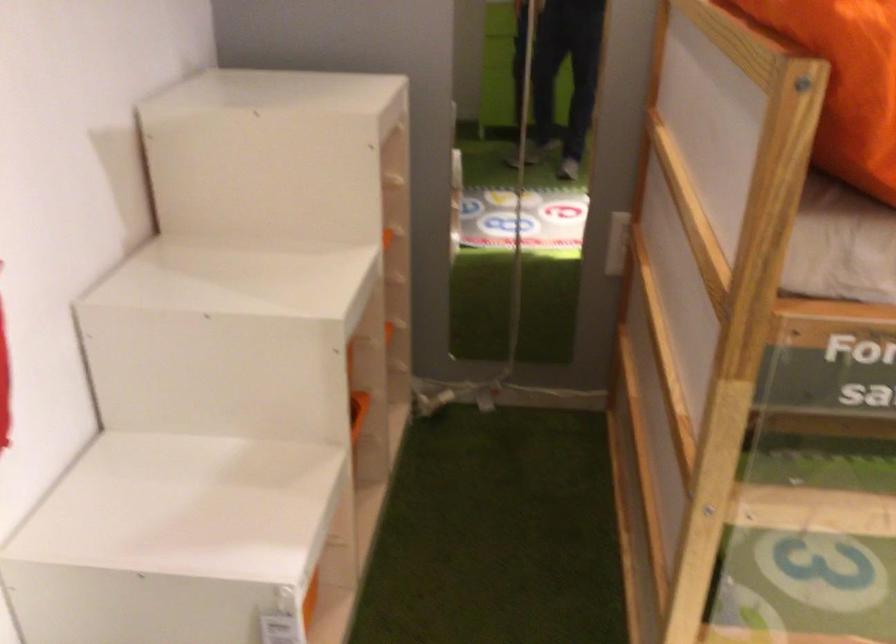
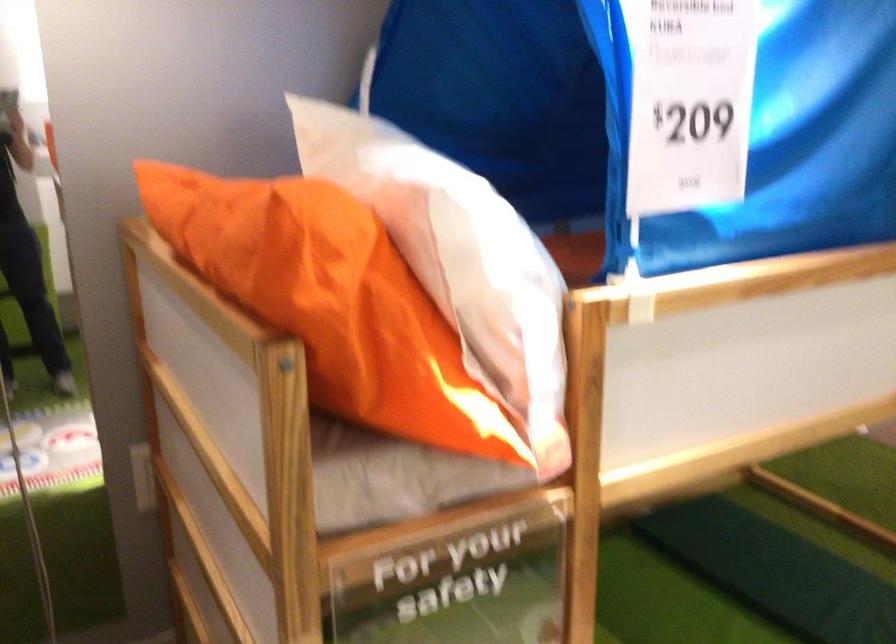
Question: The images are taken continuously from a first-person perspective. In which direction is your viewpoint rotating?

Choices:
 (A) Left
 (B) Right
 (C) Up
 (D) Down

Answer: (B)